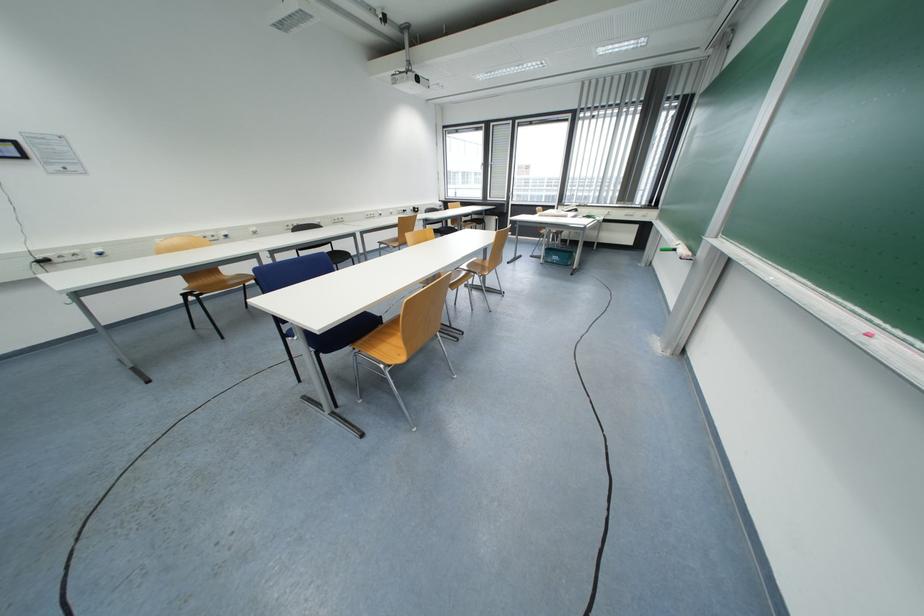
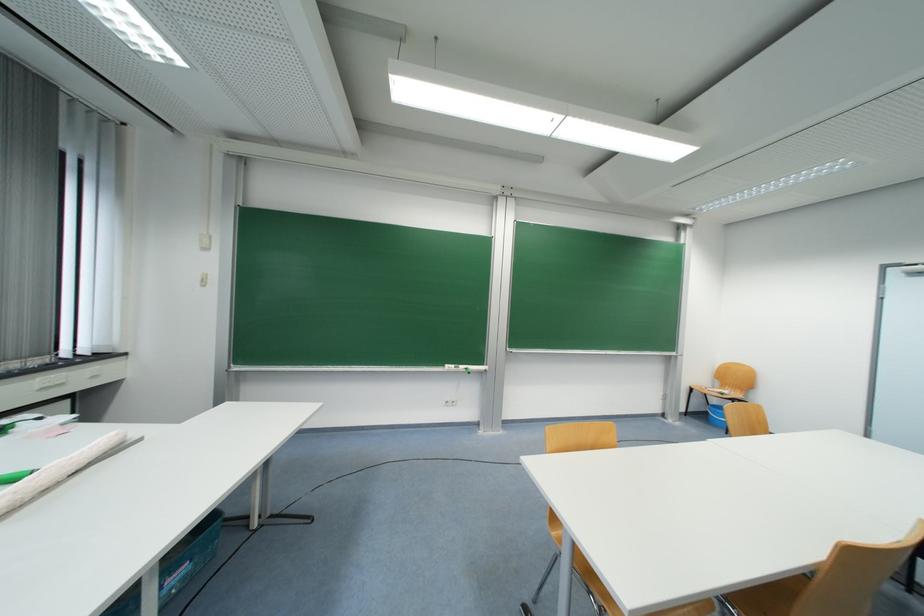
Question: I am providing you with two images of the same scene from different viewpoints. Which of the following objects are not visible in image2?

Choices:
 (A) black chair surface
 (B) wooden chair sitting surface
 (C) amazon cardboard box
 (D) white paper roll

Answer: (A)